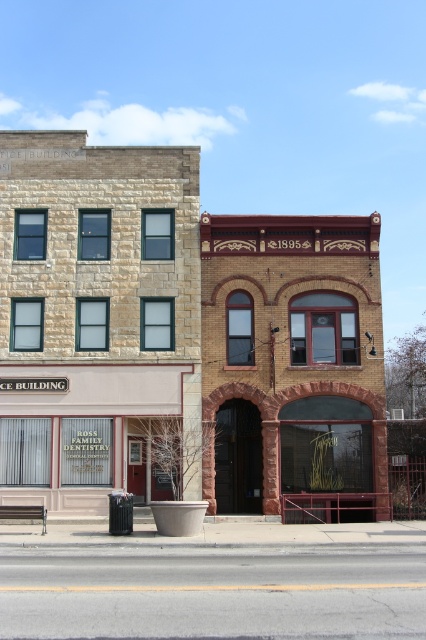
You are standing on the street in front of the two buildings. There is a point marked at coordinates (184,340). Which building does this point belong to?

The point at coordinates (184,340) is on the stone building at center.

From the picture: You are standing on the street in front of the two buildings. There is a point marked at coordinates (291, 358). Which building does this point belong to?

The point at coordinates (291, 358) is on the brown brick building at center.

You are standing on the street in front of the two buildings. There is a point marked at coordinates (x=184, y=340). Which building does this point belong to?

The point marked at coordinates (x=184, y=340) is on the stone building at center.